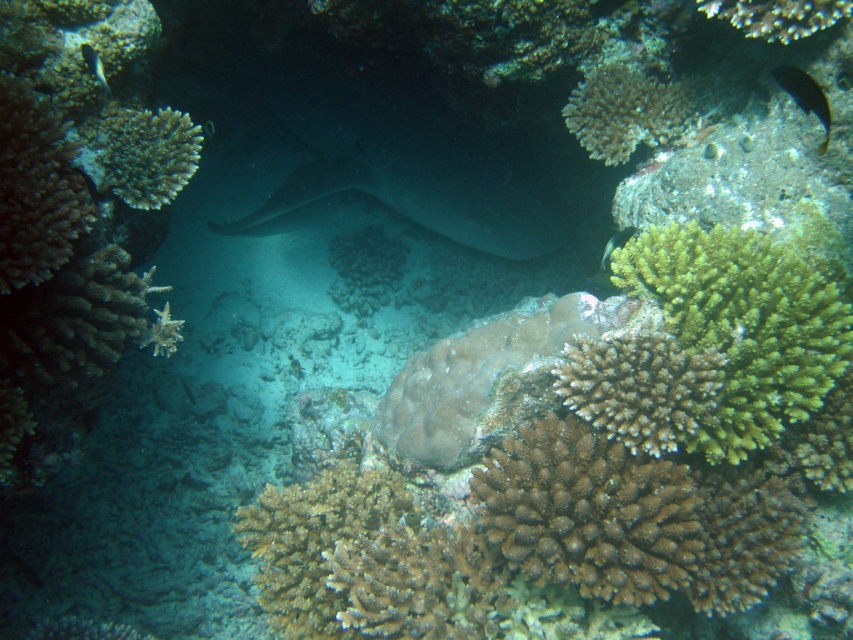
You are a marine biologist studying the coral reef. You notice two points marked in the image. The first point is at coordinates point (813, 10) and the second at point (103, 88). Based on the underwater scene, which point is closer to the foreground?

Point (103, 88) is closer to the foreground because it is in front of point (813, 10), which is behind it.

You are a marine biologist observing this underwater scene. You need to determine if the smooth gray stingray at center can fit through a gap between two rocks that is the same width as the green textured coral at upper left. Can it?

The smooth gray stingray at center is wider than the green textured coral at upper left. Since the gap between the rocks is as wide as the coral, the stingray cannot fit through the gap.

You are a marine biologist studying coral formations in the image. You notice a specific point marked at coordinates [640,387]. Which coral formation is located at that point?

The green rough coral at center is located at point [640,387].